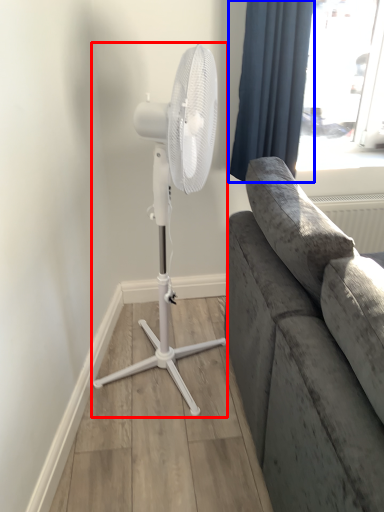
Question: Which object appears farthest to the camera in this image, mechanical fan (highlighted by a red box) or curtain (highlighted by a blue box)?

Choices:
 (A) mechanical fan
 (B) curtain

Answer: (B)